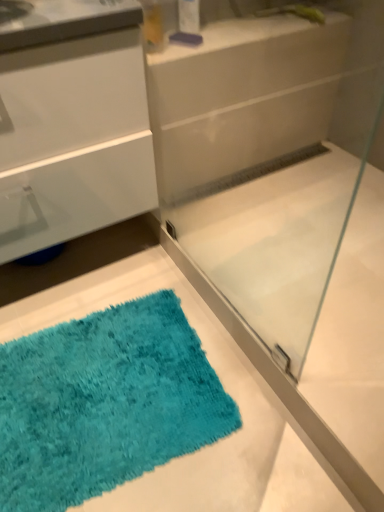
Identify the location of white glossy counter at upper center. The width and height of the screenshot is (384, 512). (253, 35).

This screenshot has height=512, width=384. What do you see at coordinates (268, 157) in the screenshot? I see `transparent glass shower door at center` at bounding box center [268, 157].

At what (x,y) coordinates should I click in order to perform the action: click on turquoise shaggy bath mat at lower left. Please return your answer as a coordinate pair (x, y). Image resolution: width=384 pixels, height=512 pixels. Looking at the image, I should click on click(x=104, y=403).

Measure the distance between point (16, 473) and camera.

They are 3.28 feet apart.

The width and height of the screenshot is (384, 512). Identify the location of white glossy counter at upper center. (253, 35).

From a real-world perspective, is transparent glass shower door at center beneath turquoise shaggy bath mat at lower left?

No.

Would you consider transparent glass shower door at center to be distant from turquoise shaggy bath mat at lower left?

No, transparent glass shower door at center is not far from turquoise shaggy bath mat at lower left.

Between transparent glass shower door at center and turquoise shaggy bath mat at lower left, which one is positioned in front?

Positioned in front is transparent glass shower door at center.

Which object is more forward, white glossy counter at upper center or turquoise shaggy bath mat at lower left?

turquoise shaggy bath mat at lower left.

Considering the positions of objects white glossy counter at upper center and turquoise shaggy bath mat at lower left in the image provided, who is more to the right, white glossy counter at upper center or turquoise shaggy bath mat at lower left?

From the viewer's perspective, white glossy counter at upper center appears more on the right side.

Could you tell me if white glossy counter at upper center is facing turquoise shaggy bath mat at lower left?

No, white glossy counter at upper center is not facing towards turquoise shaggy bath mat at lower left.

From the image's perspective, relative to turquoise shaggy bath mat at lower left, is white glossy counter at upper center above or below?

white glossy counter at upper center is above turquoise shaggy bath mat at lower left.

Which of these two, turquoise shaggy bath mat at lower left or white glossy counter at upper center, stands taller?

With more height is turquoise shaggy bath mat at lower left.

From a real-world perspective, who is located higher, turquoise shaggy bath mat at lower left or white glossy counter at upper center?

From a 3D spatial view, white glossy counter at upper center is above.

Between turquoise shaggy bath mat at lower left and white glossy counter at upper center, which one has smaller width?

white glossy counter at upper center is thinner.

Is turquoise shaggy bath mat at lower left inside the boundaries of white glossy counter at upper center, or outside?

turquoise shaggy bath mat at lower left is not inside white glossy counter at upper center, it's outside.

Considering the relative positions of white glossy counter at upper center and transparent glass shower door at center in the image provided, is white glossy counter at upper center to the left or to the right of transparent glass shower door at center?

Based on their positions, white glossy counter at upper center is located to the right of transparent glass shower door at center.

Considering the relative sizes of white glossy counter at upper center and transparent glass shower door at center in the image provided, is white glossy counter at upper center wider than transparent glass shower door at center?

Yes.

Based on the photo, is the surface of white glossy counter at upper center in direct contact with transparent glass shower door at center?

No, white glossy counter at upper center is not next to transparent glass shower door at center.

From the image's perspective, is white glossy counter at upper center located beneath transparent glass shower door at center?

No, from the image's perspective, white glossy counter at upper center is not beneath transparent glass shower door at center.

Does transparent glass shower door at center turn towards white glossy counter at upper center?

Yes, transparent glass shower door at center faces towards white glossy counter at upper center.

Which is behind, transparent glass shower door at center or white glossy counter at upper center?

white glossy counter at upper center is further from the camera.

Is transparent glass shower door at center wider or thinner than white glossy counter at upper center?

transparent glass shower door at center is thinner than white glossy counter at upper center.

Are transparent glass shower door at center and white glossy counter at upper center far apart?

No, transparent glass shower door at center is in close proximity to white glossy counter at upper center.

Looking at this image, from a real-world perspective, is turquoise shaggy bath mat at lower left positioned over transparent glass shower door at center based on gravity?

No, from a real-world perspective, turquoise shaggy bath mat at lower left is not over transparent glass shower door at center

Which of these two, turquoise shaggy bath mat at lower left or transparent glass shower door at center, is smaller?

turquoise shaggy bath mat at lower left.

Can you see turquoise shaggy bath mat at lower left touching transparent glass shower door at center?

No, turquoise shaggy bath mat at lower left is not next to transparent glass shower door at center.

Consider the image. How different are the orientations of turquoise shaggy bath mat at lower left and transparent glass shower door at center in degrees?

The angular difference between turquoise shaggy bath mat at lower left and transparent glass shower door at center is 171 degrees.

Find the location of a particular element. The width and height of the screenshot is (384, 512). glass box on the right of turquoise shaggy bath mat at lower left is located at coordinates (268, 157).

Locate an element on the screen. bath mat below the white glossy counter at upper center (from the image's perspective) is located at coordinates tap(104, 403).

Based on their spatial positions, is transparent glass shower door at center or white glossy counter at upper center closer to turquoise shaggy bath mat at lower left?

Based on the image, transparent glass shower door at center appears to be nearer to turquoise shaggy bath mat at lower left.

Estimate the real-world distances between objects in this image. Which object is closer to white glossy counter at upper center, transparent glass shower door at center or turquoise shaggy bath mat at lower left?

transparent glass shower door at center is closer to white glossy counter at upper center.

Estimate the real-world distances between objects in this image. Which object is closer to transparent glass shower door at center, white glossy counter at upper center or turquoise shaggy bath mat at lower left?

white glossy counter at upper center lies closer to transparent glass shower door at center than the other object.

From the picture: Looking at the image, which one is located closer to white glossy counter at upper center, turquoise shaggy bath mat at lower left or transparent glass shower door at center?

transparent glass shower door at center is closer to white glossy counter at upper center.

From the image, which object appears to be nearer to turquoise shaggy bath mat at lower left, white glossy counter at upper center or transparent glass shower door at center?

Among the two, transparent glass shower door at center is located nearer to turquoise shaggy bath mat at lower left.

Which object lies further to the anchor point transparent glass shower door at center, turquoise shaggy bath mat at lower left or white glossy counter at upper center?

The object further to transparent glass shower door at center is turquoise shaggy bath mat at lower left.

You are a GUI agent. You are given a task and a screenshot of the screen. Output one action in this format:
    pyautogui.click(x=<x>, y=<y>)
    Task: Click on the glass box between white glossy counter at upper center and turquoise shaggy bath mat at lower left in the up-down direction
    This screenshot has width=384, height=512.
    Given the screenshot: What is the action you would take?
    coord(268,157)